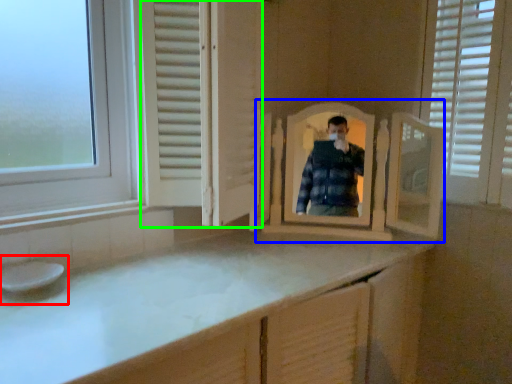
Question: Which object is the farthest from sink (highlighted by a red box)? Choose among these: mirror (highlighted by a blue box) or screen door (highlighted by a green box).

Choices:
 (A) mirror
 (B) screen door

Answer: (A)